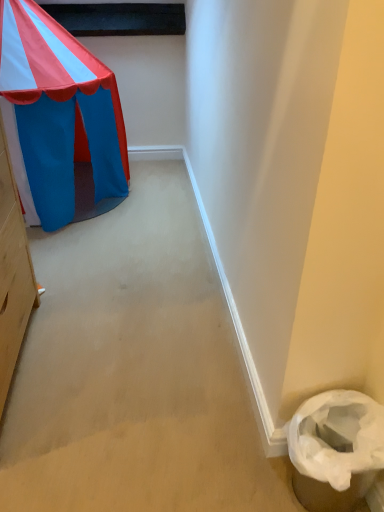
Question: Should I look upward or downward to see brown textured trash can at lower right?

Choices:
 (A) down
 (B) up

Answer: (A)